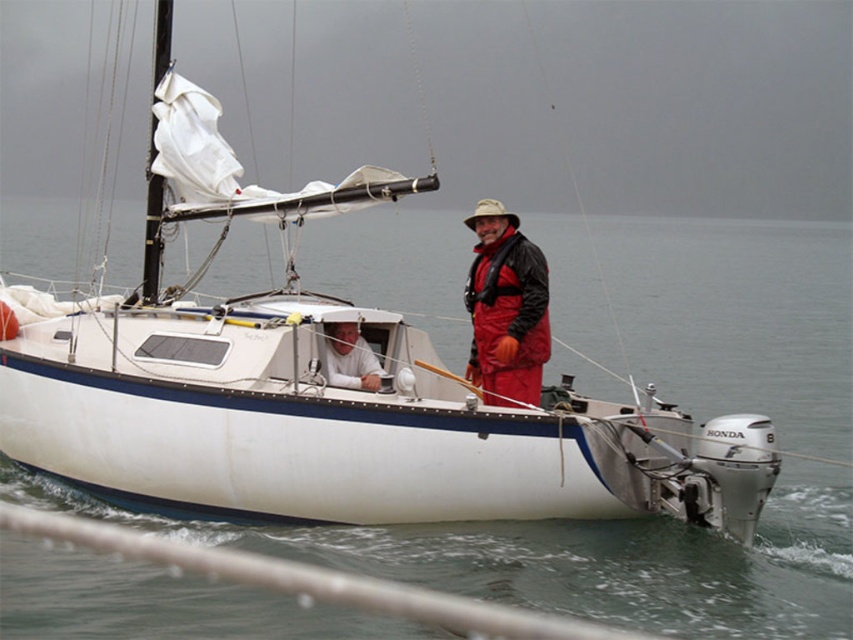
You are a photographer trying to capture the man in the red waterproof suit at center and the white sail at upper left in the same frame. Which object should you zoom in on to ensure both are visible without cropping?

You should zoom in on the white sail at upper left because it is smaller than the red waterproof suit at center, allowing both to fit within the frame when focusing on the smaller object.

Looking at this image, you are a sailor on the deck of the boat and you want to put on both the red waterproof suit at center and the white matte shirt at center. Which one should you put on first?

The red waterproof suit at center is larger in size than the white matte shirt at center, so you should put on the white matte shirt at center first before wearing the red waterproof suit at center.